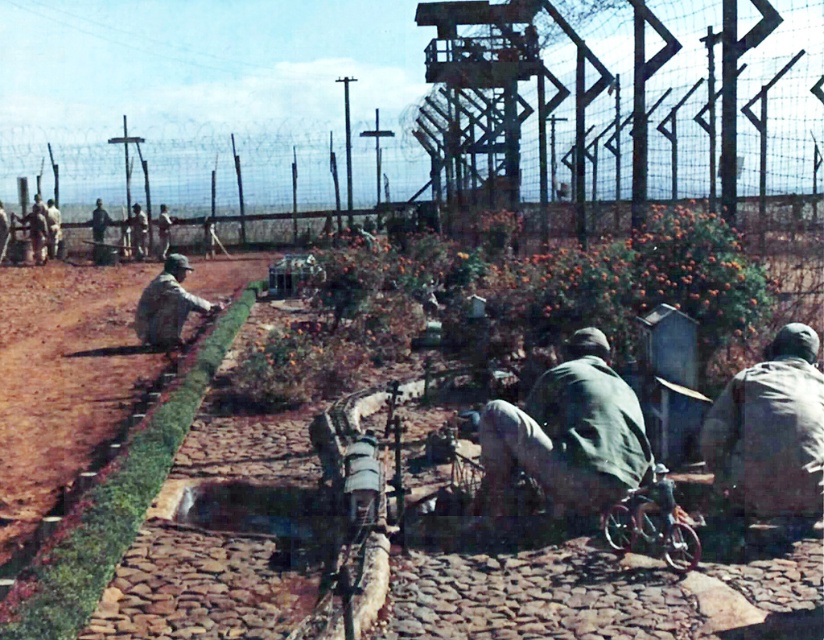
Does green matte jacket at center appear over camouflage fabric uniform at center?

No.

What do you see at coordinates (569, 433) in the screenshot? I see `green matte jacket at center` at bounding box center [569, 433].

Is point (541, 385) positioned in front of point (174, 330)?

Yes, point (541, 385) is in front of point (174, 330).

At what (x,y) coordinates should I click in order to perform the action: click on green matte jacket at center. Please return your answer as a coordinate pair (x, y). The width and height of the screenshot is (824, 640). Looking at the image, I should click on (569, 433).

Which is in front, point (765, 417) or point (133, 321)?

Point (765, 417)

Which of these two, camouflage fabric uniform at lower right or camouflage fabric uniform at center, stands shorter?

camouflage fabric uniform at center is shorter.

What do you see at coordinates (771, 429) in the screenshot?
I see `camouflage fabric uniform at lower right` at bounding box center [771, 429].

The width and height of the screenshot is (824, 640). I want to click on camouflage fabric uniform at lower right, so click(x=771, y=429).

Describe the element at coordinates (569, 433) in the screenshot. I see `green matte jacket at center` at that location.

Between green matte jacket at center and camouflage fabric uniform at lower right, which one appears on the left side from the viewer's perspective?

From the viewer's perspective, green matte jacket at center appears more on the left side.

The width and height of the screenshot is (824, 640). I want to click on green matte jacket at center, so click(569, 433).